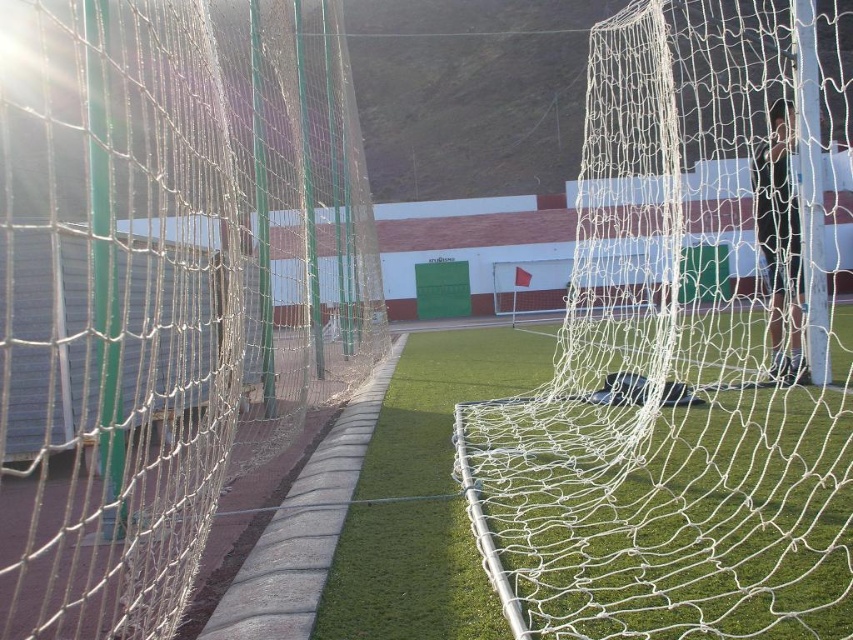
Which is more to the left, white mesh net at center or green artificial turf at center?

green artificial turf at center

Describe the element at coordinates (689, 346) in the screenshot. I see `white mesh net at center` at that location.

Describe the element at coordinates (689, 346) in the screenshot. Image resolution: width=853 pixels, height=640 pixels. I see `white mesh net at center` at that location.

You are a GUI agent. You are given a task and a screenshot of the screen. Output one action in this format:
    pyautogui.click(x=<x>, y=<y>)
    Task: Click on the white mesh net at center
    The width and height of the screenshot is (853, 640).
    Given the screenshot: What is the action you would take?
    coord(689,346)

Which is more to the left, white mesh net at left or white mesh net at center?

From the viewer's perspective, white mesh net at left appears more on the left side.

This screenshot has height=640, width=853. Describe the element at coordinates (164, 285) in the screenshot. I see `white mesh net at left` at that location.

I want to click on white mesh net at left, so click(x=164, y=285).

Which is more to the right, green artificial turf at center or black fabric man at center?

black fabric man at center

From the picture: Between green artificial turf at center and black fabric man at center, which one is positioned lower?

green artificial turf at center is below.

Identify the location of green artificial turf at center. (450, 369).